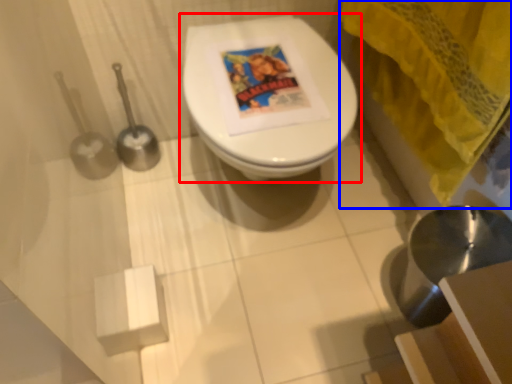
Question: Which of the following is the farthest to the observer, toilet (highlighted by a red box) or curtain (highlighted by a blue box)?

Choices:
 (A) toilet
 (B) curtain

Answer: (A)